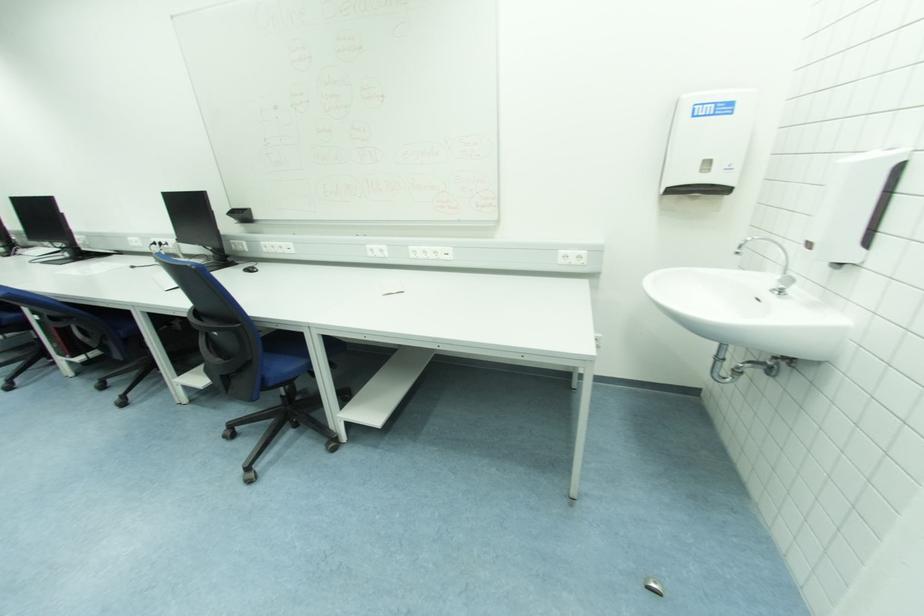
Image resolution: width=924 pixels, height=616 pixels. Describe the element at coordinates (285, 360) in the screenshot. I see `a blue chair sitting surface` at that location.